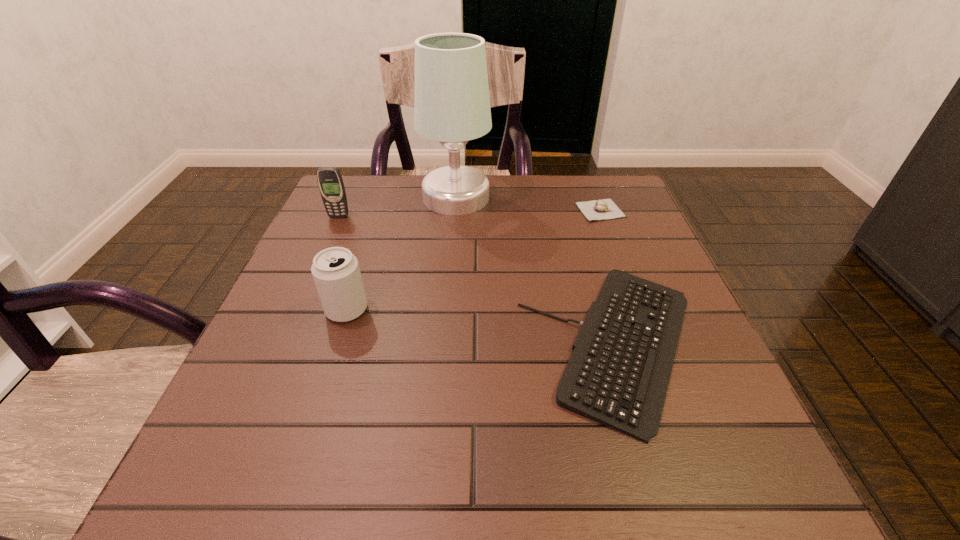
Where is `vacant space at the far edge of the desktop`? vacant space at the far edge of the desktop is located at coordinates (413, 217).

I want to click on free point at the left edge, so click(279, 420).

The height and width of the screenshot is (540, 960). I want to click on free location at the right edge, so click(x=633, y=228).

Where is `free space at the far left corner of the desktop`? free space at the far left corner of the desktop is located at coordinates (392, 181).

Locate an element on the screen. The height and width of the screenshot is (540, 960). empty space between the can and the computer keyboard is located at coordinates (481, 327).

You are a GUI agent. You are given a task and a screenshot of the screen. Output one action in this format:
    pyautogui.click(x=<x>, y=<y>)
    Task: Click on the unoccupied position between the tallest object and the garlic
    The height and width of the screenshot is (540, 960).
    Given the screenshot: What is the action you would take?
    pyautogui.click(x=528, y=204)

At what (x,y) coordinates should I click in order to perform the action: click on unoccupied area between the can and the second shortest object. Please return your answer as a coordinate pair (x, y). The width and height of the screenshot is (960, 540). Looking at the image, I should click on (473, 260).

Locate an element on the screen. free space between the leftmost object and the tallest object is located at coordinates (397, 207).

You are a GUI agent. You are given a task and a screenshot of the screen. Output one action in this format:
    pyautogui.click(x=<x>, y=<y>)
    Task: Click on the free space between the fourth tallest object and the lampshade
    
    Given the screenshot: What is the action you would take?
    pyautogui.click(x=528, y=204)

Where is `vacant area that lies between the garlic and the second object from left to right`? The image size is (960, 540). vacant area that lies between the garlic and the second object from left to right is located at coordinates (473, 260).